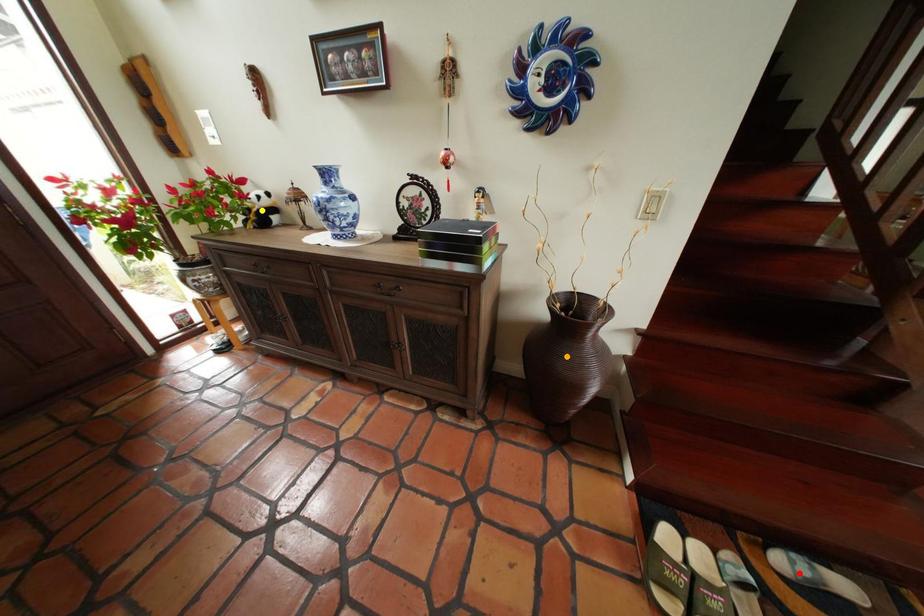
Order these from nearest to farthest:
orange point
yellow point
red point

red point, orange point, yellow point